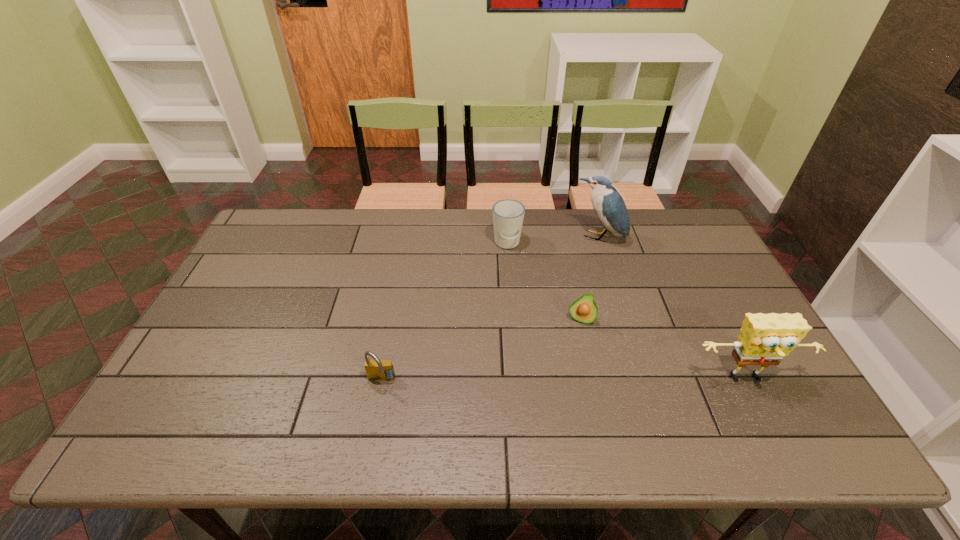
Where is `unoccupied area between the cup and the bird`? unoccupied area between the cup and the bird is located at coordinates (553, 241).

This screenshot has width=960, height=540. Identify the location of free space between the bird and the cup. (553, 241).

Where is `unoccupied area between the bird and the rightmost object`? This screenshot has height=540, width=960. unoccupied area between the bird and the rightmost object is located at coordinates (673, 309).

Identify the location of free space between the avocado and the sponge. (663, 349).

Where is `blank region between the bird and the avocado`? This screenshot has height=540, width=960. blank region between the bird and the avocado is located at coordinates (589, 279).

Identify the location of vacant area between the bird and the padlock. The height and width of the screenshot is (540, 960). (490, 309).

Choose which object is the nearest neighbor to the third tallest object. Please provide its 2D coordinates. Your answer should be formatted as a tuple, i.e. [(x, y)], where the tuple contains the x and y coordinates of a point satisfying the conditions above.

[(608, 204)]

Where is `object that is the fourth closest to the leftmost object`? object that is the fourth closest to the leftmost object is located at coordinates 764,339.

Locate an element on the screen. vacant region that satisfies the following two spatial constraints: 1. on the front side of the third farthest object; 2. on the right side of the second object from left to right is located at coordinates (513, 319).